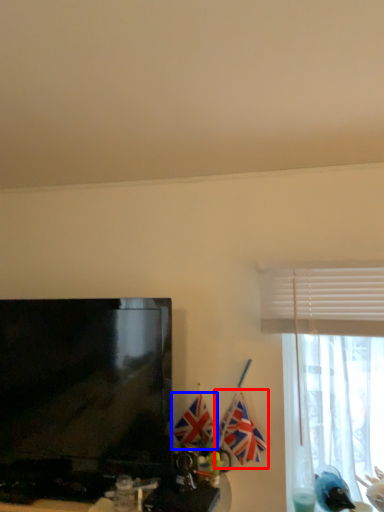
Question: Among these objects, which one is nearest to the camera, flag (highlighted by a red box) or flag (highlighted by a blue box)?

Choices:
 (A) flag
 (B) flag

Answer: (A)